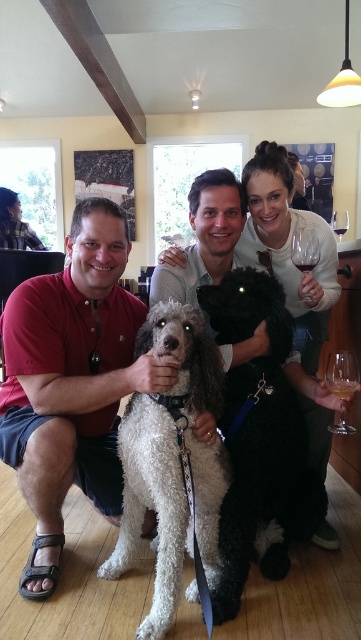
Who is positioned more to the left, black fuzzy dog at center or clear glass at lower right?

black fuzzy dog at center is more to the left.

Measure the distance between point (251, 326) and camera.

Point (251, 326) and camera are 5.44 feet apart.

Image resolution: width=361 pixels, height=640 pixels. I want to click on black fuzzy dog at center, so click(x=255, y=433).

Does point (158, 516) lie behind point (335, 228)?

No.

Does white fluffy dog at center have a greater height compared to transparent glass at upper right?

Correct, white fluffy dog at center is much taller as transparent glass at upper right.

Does point (131, 512) lie in front of point (337, 228)?

Yes, it is in front of point (337, 228).

Identify the location of white fluffy dog at center. This screenshot has height=640, width=361. (171, 461).

Is shiny black dog at center smaller than clear glass at lower right?

No.

I want to click on shiny black dog at center, so click(x=288, y=248).

Describe the element at coordinates (288, 248) in the screenshot. I see `shiny black dog at center` at that location.

Where is `shiny black dog at center`? The height and width of the screenshot is (640, 361). shiny black dog at center is located at coordinates pyautogui.click(x=288, y=248).